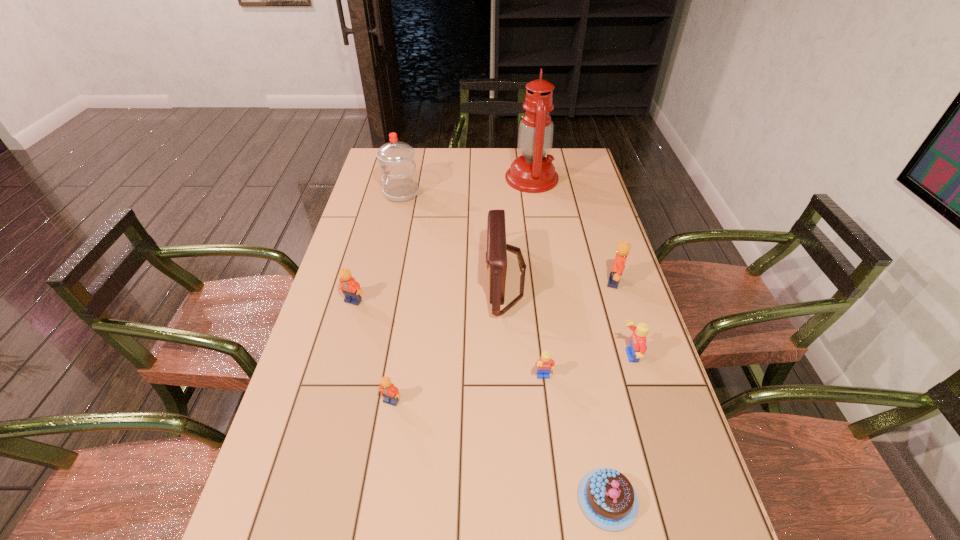
In the image, there is a desktop. At what (x,y) coordinates should I click in order to perform the action: click on vacant space at the right edge. Please return your answer as a coordinate pair (x, y). The image size is (960, 540). Looking at the image, I should click on (660, 451).

I want to click on vacant area at the far left corner, so click(377, 170).

You are a GUI agent. You are given a task and a screenshot of the screen. Output one action in this format:
    pyautogui.click(x=<x>, y=<y>)
    Task: Click on the empty location between the second Lego from left to right and the nearer yellow Lego
    This screenshot has width=960, height=540.
    Given the screenshot: What is the action you would take?
    pyautogui.click(x=468, y=389)

At what (x,y) coordinates should I click in order to perform the action: click on free space between the eighth shortest object and the rightmost orange Lego. Please return your answer as a coordinate pair (x, y). Image resolution: width=960 pixels, height=540 pixels. Looking at the image, I should click on (508, 238).

In order to click on empty location between the smallest orange Lego and the biggest orange Lego in this screenshot , I will do (503, 341).

Locate an element on the screen. The height and width of the screenshot is (540, 960). free space between the shoulder bag and the third nearest object is located at coordinates (525, 328).

The width and height of the screenshot is (960, 540). Find the location of `free space between the shoulder bag and the farthest Lego`. free space between the shoulder bag and the farthest Lego is located at coordinates (560, 280).

Locate an element on the screen. The height and width of the screenshot is (540, 960). free area in between the farthest orange Lego and the fourth farthest Lego is located at coordinates (579, 330).

Find the location of a particular element. Image resolution: width=960 pixels, height=540 pixels. empty space between the second smallest orange Lego and the shoulder bag is located at coordinates (429, 289).

You are a GUI agent. You are given a task and a screenshot of the screen. Output one action in this format:
    pyautogui.click(x=<x>, y=<y>)
    Task: Click on the free point between the third farthest Lego and the second tallest object
    This screenshot has width=960, height=540.
    Given the screenshot: What is the action you would take?
    pyautogui.click(x=515, y=275)